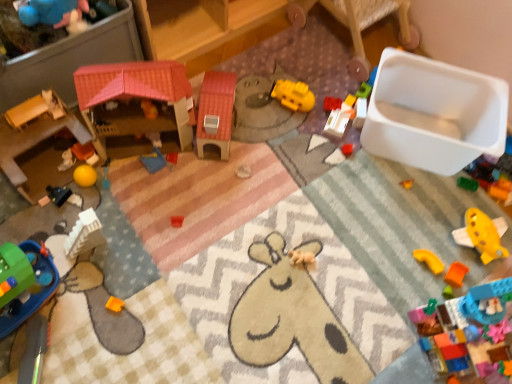
Locate an element on the screen. The width and height of the screenshot is (512, 384). vacant area that is in front of blue plastic tray at center, acting as the 6th toy starting from the left is located at coordinates (145, 208).